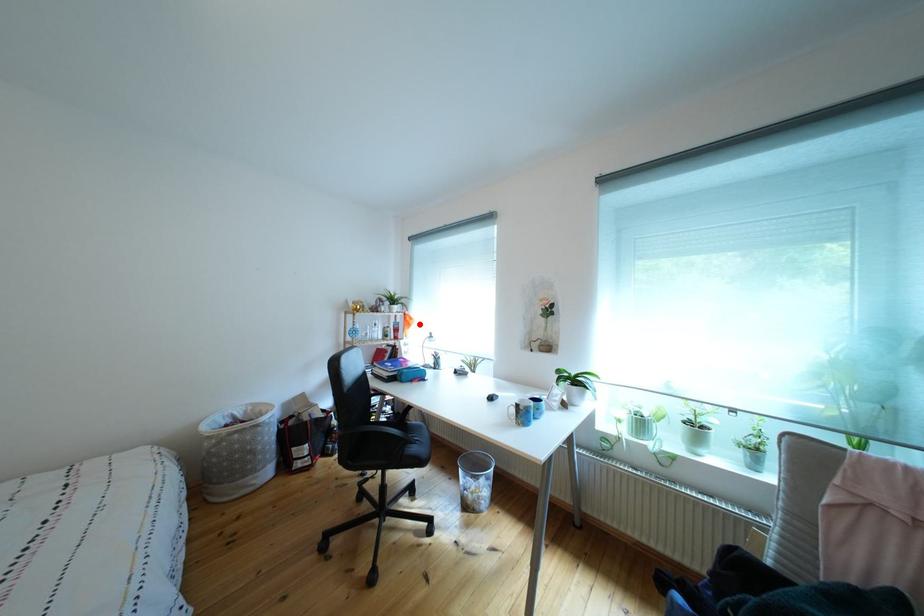
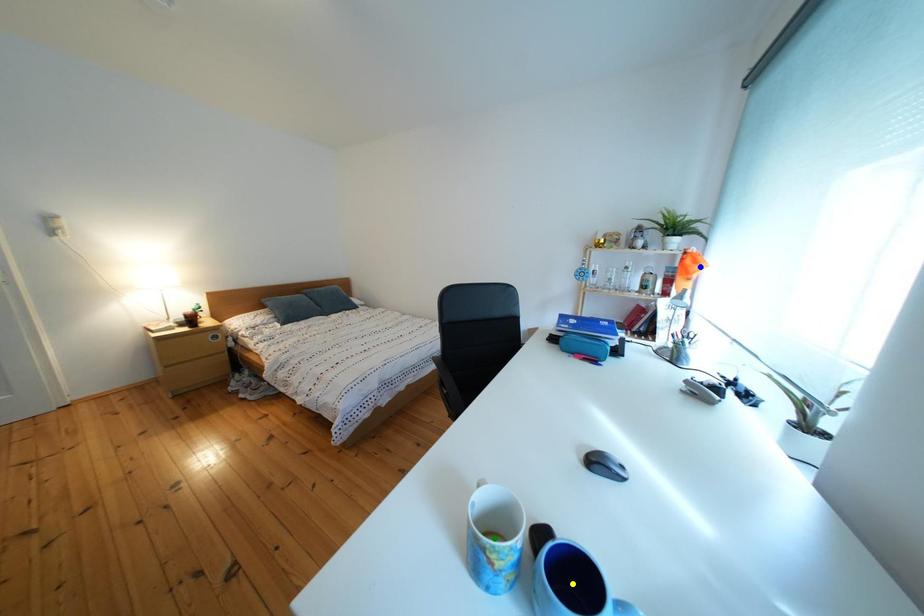
Question: I am providing you with two images of the same scene from different viewpoints. A red point is marked on the first image. You are given multiple points on the second image. Which spot in image 2 lines up with the point in image 1?

Choices:
 (A) blue point
 (B) yellow point
 (C) green point

Answer: (A)